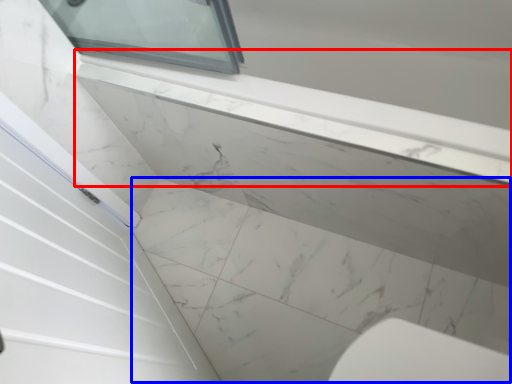
Question: Among these objects, which one is nearest to the camera, window sill (highlighted by a red box) or concrete (highlighted by a blue box)?

Choices:
 (A) window sill
 (B) concrete

Answer: (A)